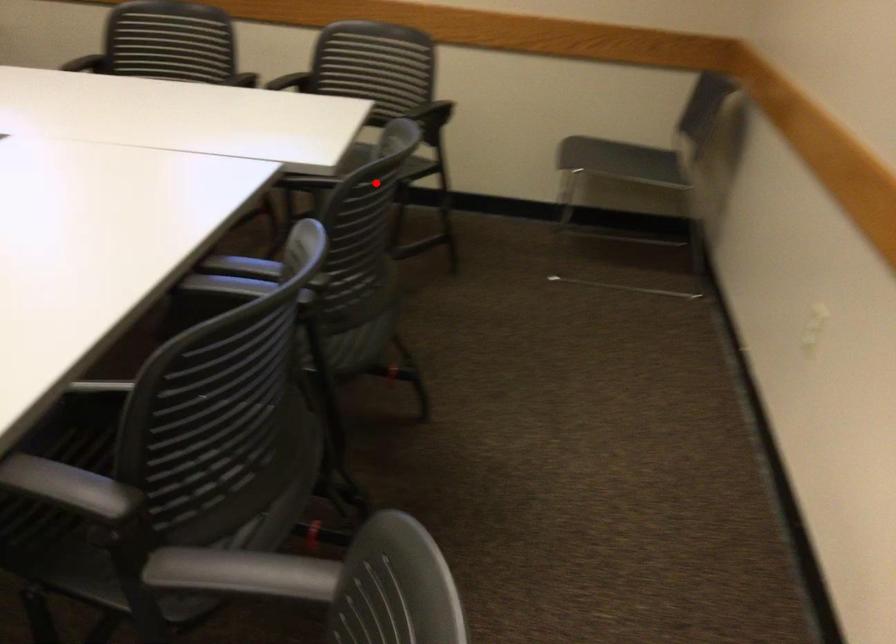
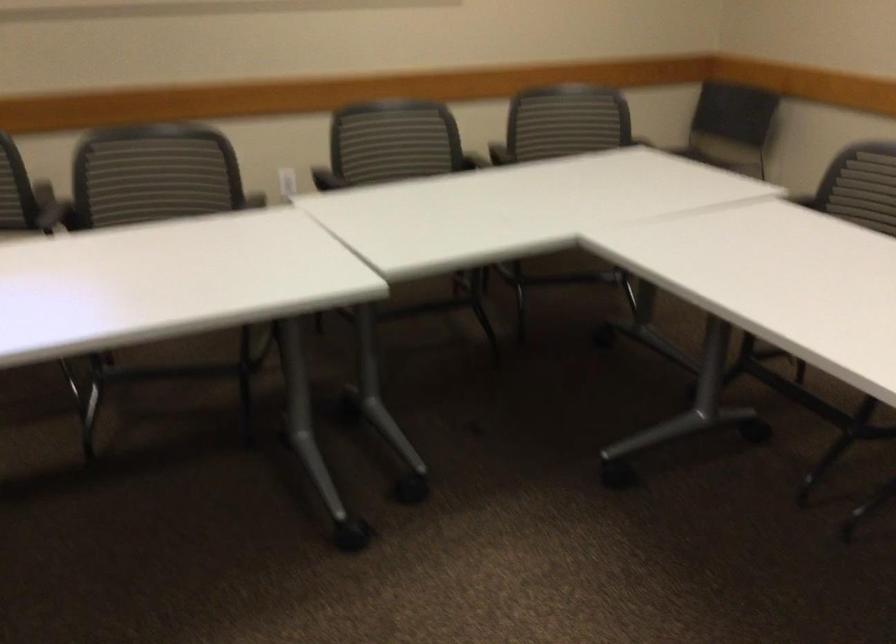
Question: I am providing you with two images of the same scene from different viewpoints. Image1 has a red point marked. In image2, the corresponding 3D location appears at what relative position? Reply with the corresponding letter.

Choices:
 (A) Closer
 (B) Farther

Answer: (B)